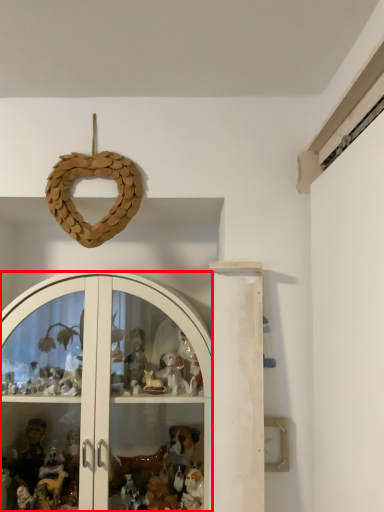
Question: From the image, what is the correct spatial relationship of glass door (annotated by the red box) in relation to toy?

Choices:
 (A) left
 (B) right

Answer: (A)